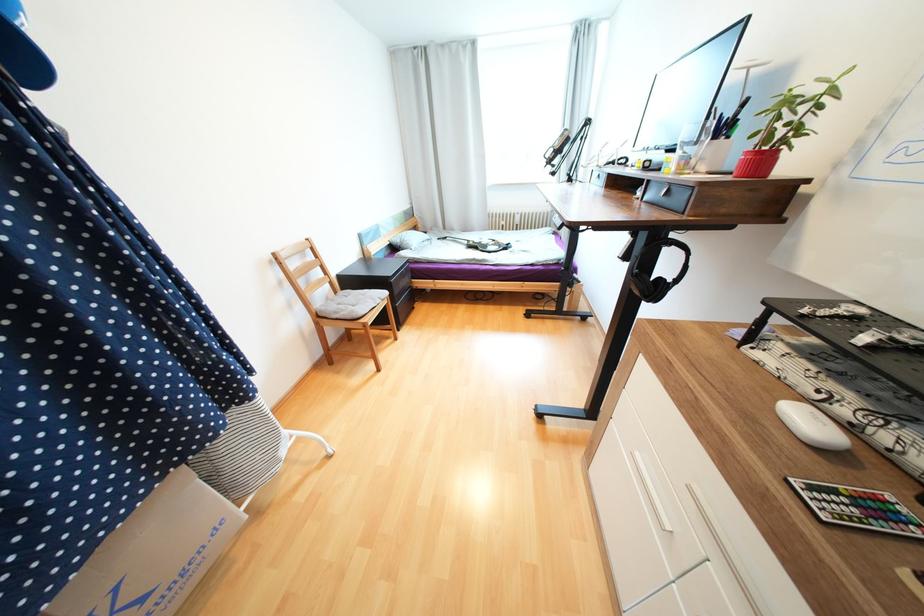
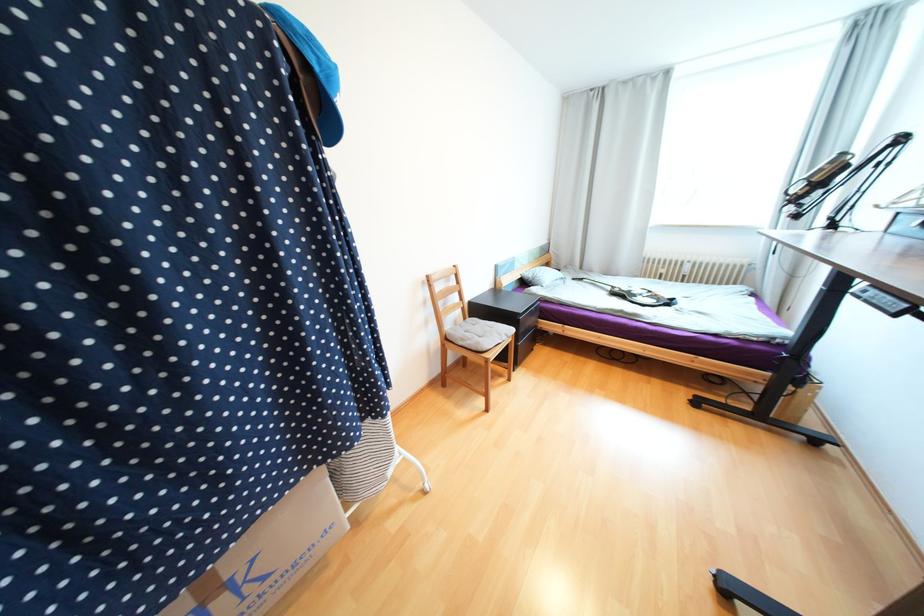
Question: Based on the continuous images, in which direction is the camera rotating? Reply with the corresponding letter.

Choices:
 (A) Left
 (B) Right
 (C) Up
 (D) Down

Answer: (A)